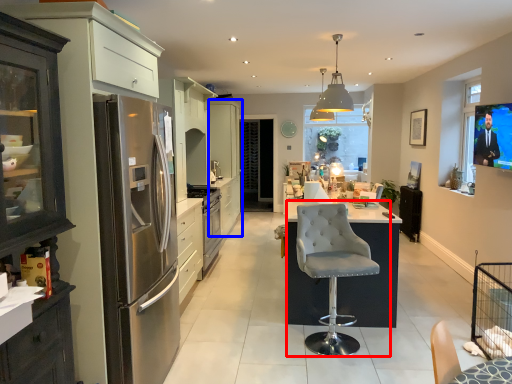
Question: Which object appears closest to the camera in this image, chair (highlighted by a red box) or cabinetry (highlighted by a blue box)?

Choices:
 (A) chair
 (B) cabinetry

Answer: (A)